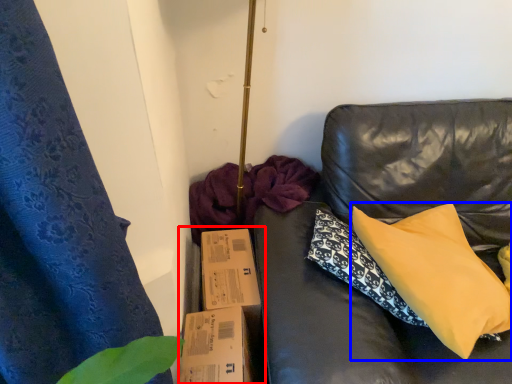
Question: Which object is further to the camera taking this photo, cardboard box (highlighted by a red box) or pillow (highlighted by a blue box)?

Choices:
 (A) cardboard box
 (B) pillow

Answer: (A)